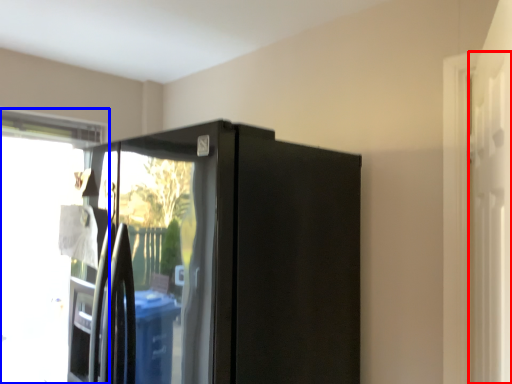
Question: Which of the following is the closest to the observer, screen door (highlighted by a red box) or window (highlighted by a blue box)?

Choices:
 (A) screen door
 (B) window

Answer: (A)